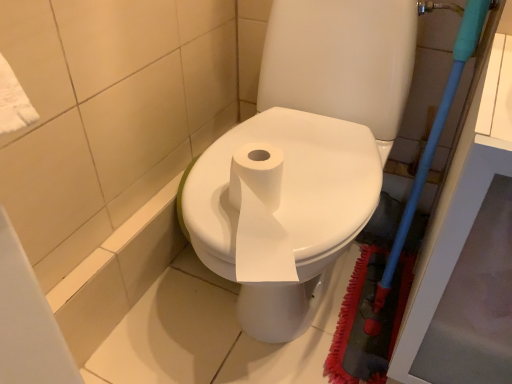
What is the approximate height of white glossy toilet at center?

It is 29.74 inches.

Describe the element at coordinates (306, 153) in the screenshot. I see `white glossy toilet at center` at that location.

In order to click on white glossy toilet at center in this screenshot , I will do `click(306, 153)`.

The image size is (512, 384). Describe the element at coordinates (434, 136) in the screenshot. I see `blue plastic brush at right` at that location.

Where is `blue plastic brush at right`? This screenshot has height=384, width=512. blue plastic brush at right is located at coordinates (434, 136).

You are a GUI agent. You are given a task and a screenshot of the screen. Output one action in this format:
    pyautogui.click(x=<x>, y=<y>)
    Task: Click on the white glossy toilet at center
    
    Given the screenshot: What is the action you would take?
    pyautogui.click(x=306, y=153)

Does white glossy toilet at center appear on the right side of blue plastic brush at right?

No.

Is white glossy toilet at center closer to the viewer compared to blue plastic brush at right?

No, white glossy toilet at center is further to the viewer.

Is point (264, 317) in front of point (370, 332)?

Yes, it is.

Consider the image. From the image's perspective, is white glossy toilet at center located above or below blue plastic brush at right?

From the image's perspective, white glossy toilet at center appears above blue plastic brush at right.

From a real-world perspective, does white glossy toilet at center stand above blue plastic brush at right?

Yes, from a real-world perspective, white glossy toilet at center is on top of blue plastic brush at right.

Looking at this image, in terms of width, does white glossy toilet at center look wider or thinner when compared to blue plastic brush at right?

Considering their sizes, white glossy toilet at center looks broader than blue plastic brush at right.

Considering the relative sizes of white glossy toilet at center and blue plastic brush at right in the image provided, is white glossy toilet at center taller than blue plastic brush at right?

Correct, white glossy toilet at center is much taller as blue plastic brush at right.

Considering the relative sizes of white glossy toilet at center and blue plastic brush at right in the image provided, is white glossy toilet at center smaller than blue plastic brush at right?

Actually, white glossy toilet at center might be larger than blue plastic brush at right.

Is white glossy toilet at center inside or outside of blue plastic brush at right?

white glossy toilet at center lies outside blue plastic brush at right.

Would you say white glossy toilet at center is a long distance from blue plastic brush at right?

white glossy toilet at center is near blue plastic brush at right, not far away.

Could you tell me if white glossy toilet at center is facing blue plastic brush at right?

No.

What's the angular difference between white glossy toilet at center and blue plastic brush at right's facing directions?

The angle between the facing direction of white glossy toilet at center and the facing direction of blue plastic brush at right is 1.84 degrees.

How distant is white glossy toilet at center from blue plastic brush at right?

A distance of 9.85 inches exists between white glossy toilet at center and blue plastic brush at right.

The height and width of the screenshot is (384, 512). Identify the location of brush in front of the white glossy toilet at center. (434, 136).

Which is more to the left, blue plastic brush at right or white glossy toilet at center?

Positioned to the left is white glossy toilet at center.

Is the position of blue plastic brush at right more distant than that of white glossy toilet at center?

No, it is in front of white glossy toilet at center.

Is point (457, 67) positioned behind point (331, 7)?

No, (457, 67) is closer to viewer.

From the image's perspective, who appears lower, blue plastic brush at right or white glossy toilet at center?

blue plastic brush at right appears lower in the image.

From a real-world perspective, which object stands above the other?

From a 3D spatial view, white glossy toilet at center is above.

Which of these two, blue plastic brush at right or white glossy toilet at center, is thinner?

Thinner between the two is blue plastic brush at right.

Does blue plastic brush at right have a lesser height compared to white glossy toilet at center?

Correct, blue plastic brush at right is not as tall as white glossy toilet at center.

Does blue plastic brush at right have a smaller size compared to white glossy toilet at center?

Yes, blue plastic brush at right is smaller than white glossy toilet at center.

Is white glossy toilet at center a part of blue plastic brush at right?

Actually, white glossy toilet at center is outside blue plastic brush at right.

Is blue plastic brush at right far away from white glossy toilet at center?

No, there isn't a large distance between blue plastic brush at right and white glossy toilet at center.

Is blue plastic brush at right facing towards white glossy toilet at center?

No, blue plastic brush at right is not aimed at white glossy toilet at center.

From the picture: Measure the distance from blue plastic brush at right to white glossy toilet at center.

They are 9.85 inches apart.

The height and width of the screenshot is (384, 512). In order to click on brush in front of the white glossy toilet at center in this screenshot , I will do `click(434, 136)`.

Identify the location of brush on the right of white glossy toilet at center. Image resolution: width=512 pixels, height=384 pixels. (434, 136).

In the image, there is a blue plastic brush at right. Identify the location of toilet above it (from the image's perspective). (306, 153).